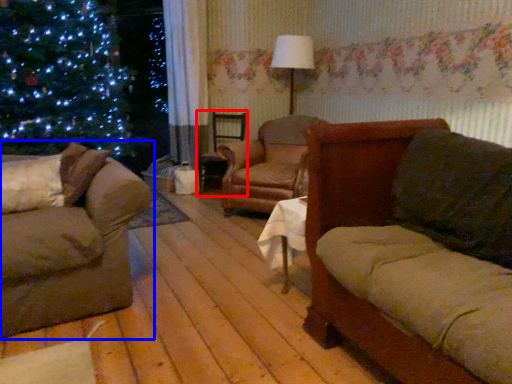
Question: Which object appears closest to the camera in this image, swivel chair (highlighted by a red box) or studio couch (highlighted by a blue box)?

Choices:
 (A) swivel chair
 (B) studio couch

Answer: (B)